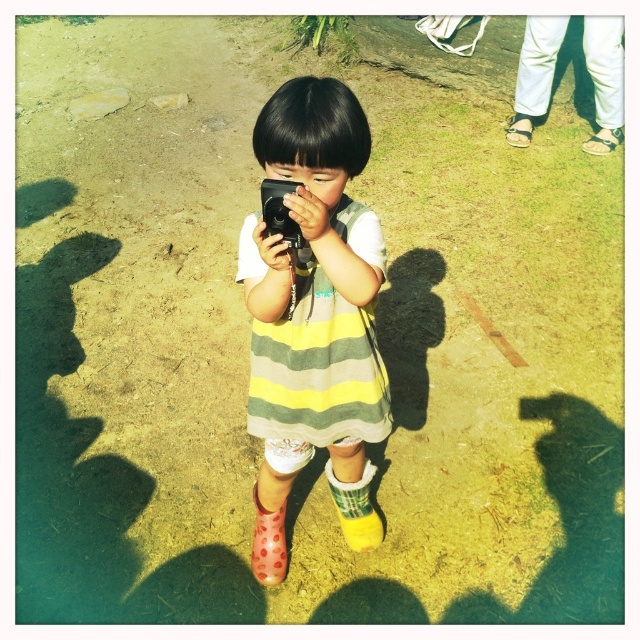
Question: Is white soft sock at lower center bigger than brown leather sandal at upper right?

Choices:
 (A) yes
 (B) no

Answer: (A)

Question: Can you confirm if yellow striped dress at center is positioned to the right of pink dotted rubber boot at lower left?

Choices:
 (A) yes
 (B) no

Answer: (A)

Question: Is yellow striped dress at center to the right of white leather sandals at upper right from the viewer's perspective?

Choices:
 (A) yes
 (B) no

Answer: (B)

Question: Which of the following is the closest to the observer?

Choices:
 (A) (602, 128)
 (B) (369, 540)
 (C) (285, 186)

Answer: (C)

Question: Among these objects, which one is farthest from the camera?

Choices:
 (A) white leather sandals at upper right
 (B) brown leather sandal at upper right
 (C) yellow striped dress at center
 (D) black plastic camera at center

Answer: (B)

Question: Among these points, which one is farthest from the camera?

Choices:
 (A) (272, 216)
 (B) (541, 64)
 (C) (330, 200)
 (D) (602, 136)

Answer: (D)